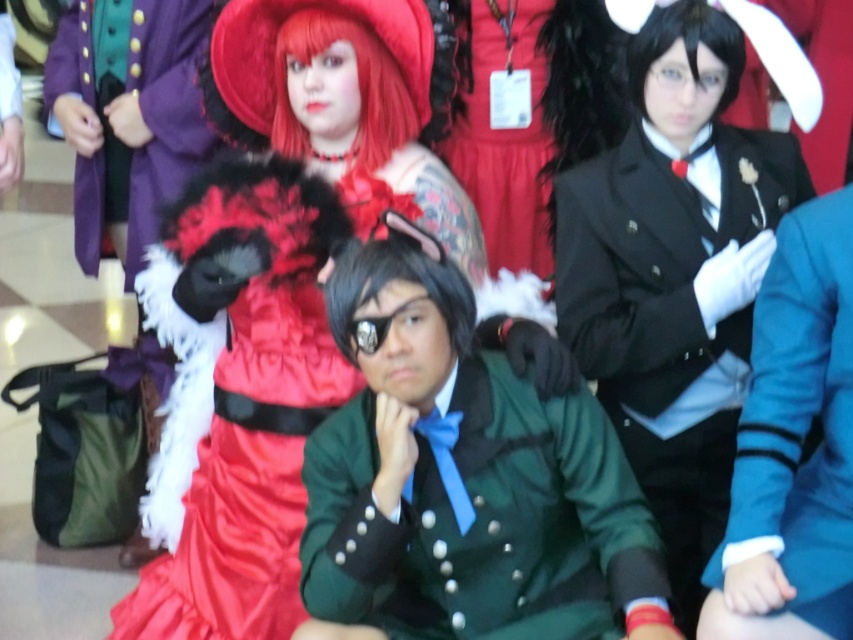
Does green satin uniform at center appear over black satin blazer at upper right?

Incorrect, green satin uniform at center is not positioned above black satin blazer at upper right.

What do you see at coordinates (480, 520) in the screenshot? This screenshot has width=853, height=640. I see `green satin uniform at center` at bounding box center [480, 520].

Locate an element on the screen. green satin uniform at center is located at coordinates (480, 520).

Is point (648, 460) more distant than point (827, 262)?

Yes.

Measure the distance between black satin blazer at upper right and camera.

7.08 feet

The height and width of the screenshot is (640, 853). What do you see at coordinates (670, 314) in the screenshot?
I see `black satin blazer at upper right` at bounding box center [670, 314].

Locate an element on the screen. black satin blazer at upper right is located at coordinates (670, 314).

Between green satin uniform at center and teal wool blazer at right, which one appears on the right side from the viewer's perspective?

From the viewer's perspective, teal wool blazer at right appears more on the right side.

Does green satin uniform at center have a greater height compared to teal wool blazer at right?

Incorrect, green satin uniform at center's height is not larger of teal wool blazer at right's.

Where is `green satin uniform at center`? The height and width of the screenshot is (640, 853). green satin uniform at center is located at coordinates (480, 520).